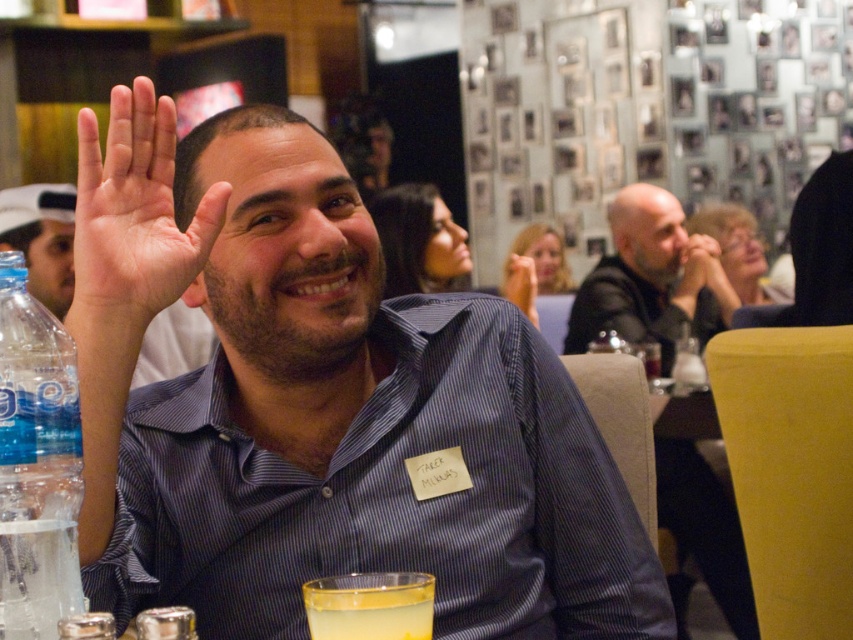
Is matte skin hand at center to the right of clear plastic bottle at lower left from the viewer's perspective?

Indeed, matte skin hand at center is positioned on the right side of clear plastic bottle at lower left.

Which of these two, matte skin hand at center or clear plastic bottle at lower left, stands shorter?

With less height is clear plastic bottle at lower left.

You are a GUI agent. You are given a task and a screenshot of the screen. Output one action in this format:
    pyautogui.click(x=<x>, y=<y>)
    Task: Click on the matte skin hand at center
    Image resolution: width=853 pixels, height=640 pixels.
    Given the screenshot: What is the action you would take?
    pyautogui.click(x=697, y=262)

Can you confirm if matte black shirt at center is positioned to the right of matte black hand at upper center?

In fact, matte black shirt at center is to the left of matte black hand at upper center.

Is point (44, 301) behind point (535, 292)?

Yes, it is.

You are a GUI agent. You are given a task and a screenshot of the screen. Output one action in this format:
    pyautogui.click(x=<x>, y=<y>)
    Task: Click on the matte black shirt at center
    
    Given the screenshot: What is the action you would take?
    pyautogui.click(x=41, y=237)

Which of these two, smooth black jacket at upper right or yellow plastic table at lower right, stands taller?

smooth black jacket at upper right is taller.

Who is more forward, [590,294] or [680,408]?

Positioned in front is point [680,408].

This screenshot has height=640, width=853. I want to click on smooth black jacket at upper right, so click(x=651, y=278).